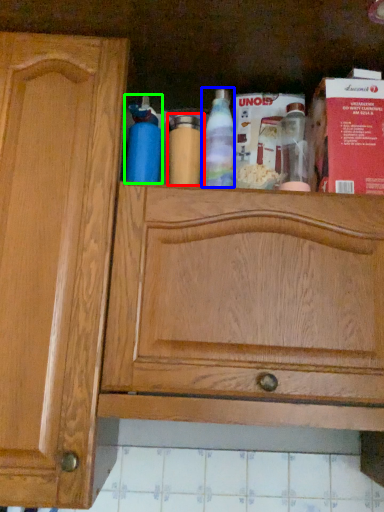
Question: Which object is positioned closest to bottle (highlighted by a red box)? Select from bottle (highlighted by a blue box) and bottle (highlighted by a green box).

Choices:
 (A) bottle
 (B) bottle

Answer: (A)